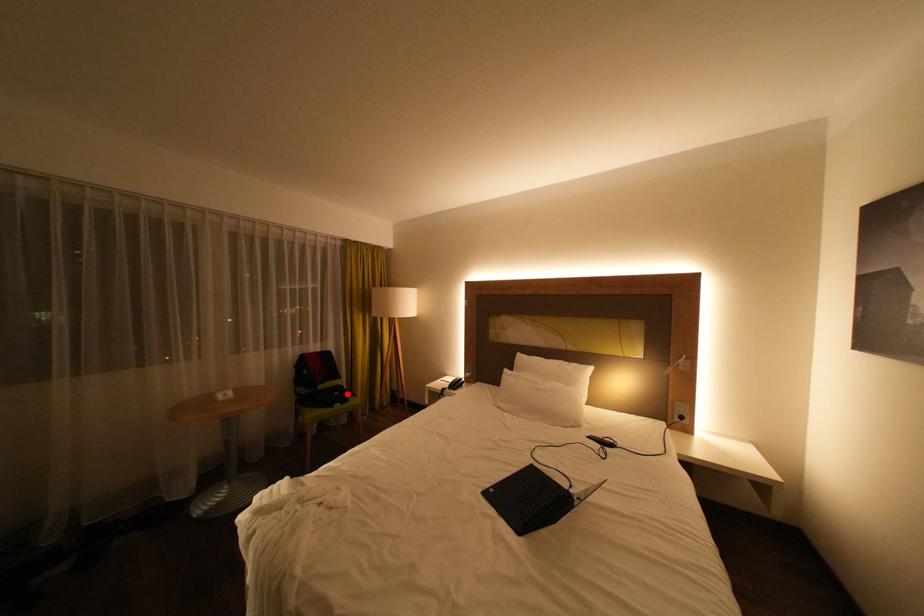
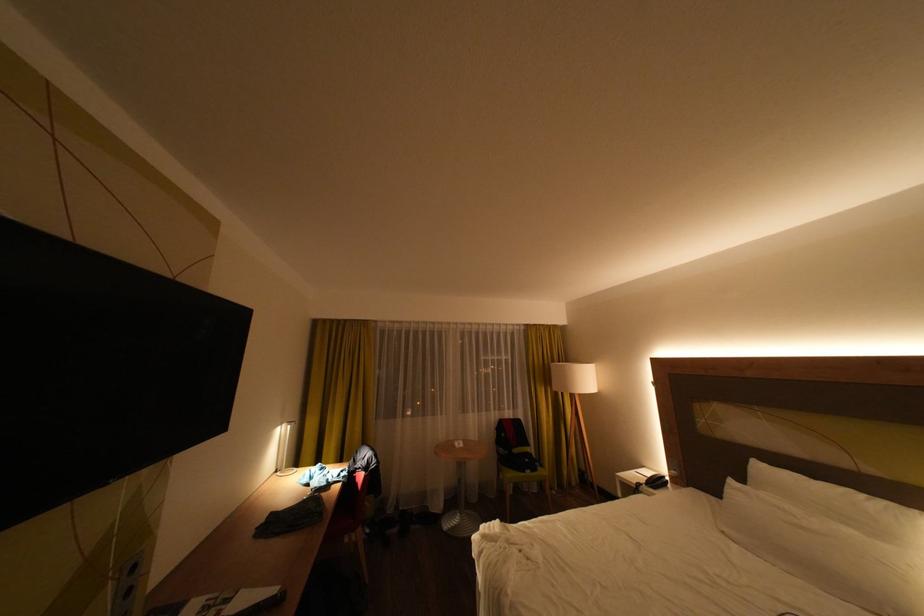
The point at the highlighted location is marked in the first image. Where is the corresponding point in the second image?

(538, 460)